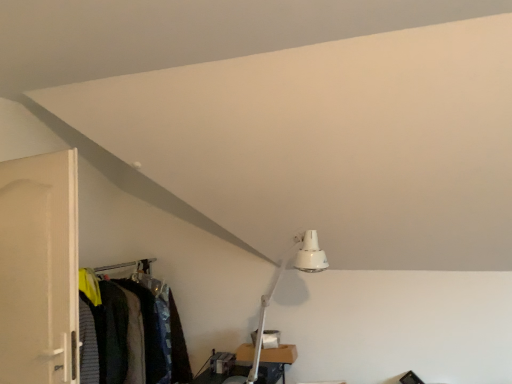
Question: Is white matte door at left facing away from textured fabric closet at lower left?

Choices:
 (A) no
 (B) yes

Answer: (B)

Question: Is white matte door at left with textured fabric closet at lower left?

Choices:
 (A) yes
 (B) no

Answer: (B)

Question: Is white matte door at left at the left side of textured fabric closet at lower left?

Choices:
 (A) no
 (B) yes

Answer: (B)

Question: Does white matte door at left have a lesser width compared to textured fabric closet at lower left?

Choices:
 (A) no
 (B) yes

Answer: (B)

Question: Is white matte door at left further to camera compared to textured fabric closet at lower left?

Choices:
 (A) yes
 (B) no

Answer: (B)

Question: Can you confirm if white matte door at left is taller than textured fabric closet at lower left?

Choices:
 (A) yes
 (B) no

Answer: (A)

Question: Would you say textured fabric closet at lower left is a long distance from white matte door at left?

Choices:
 (A) yes
 (B) no

Answer: (B)

Question: Would you say white matte door at left is part of textured fabric closet at lower left's contents?

Choices:
 (A) yes
 (B) no

Answer: (B)

Question: Can you confirm if textured fabric closet at lower left is smaller than white matte door at left?

Choices:
 (A) yes
 (B) no

Answer: (A)

Question: Can you confirm if textured fabric closet at lower left is thinner than white matte door at left?

Choices:
 (A) no
 (B) yes

Answer: (A)

Question: Does textured fabric closet at lower left have a greater width compared to white matte door at left?

Choices:
 (A) no
 (B) yes

Answer: (B)

Question: Considering the relative sizes of textured fabric closet at lower left and white matte door at left in the image provided, is textured fabric closet at lower left shorter than white matte door at left?

Choices:
 (A) no
 (B) yes

Answer: (B)

Question: From the image's perspective, relative to white matte door at left, is textured fabric closet at lower left above or below?

Choices:
 (A) below
 (B) above

Answer: (A)